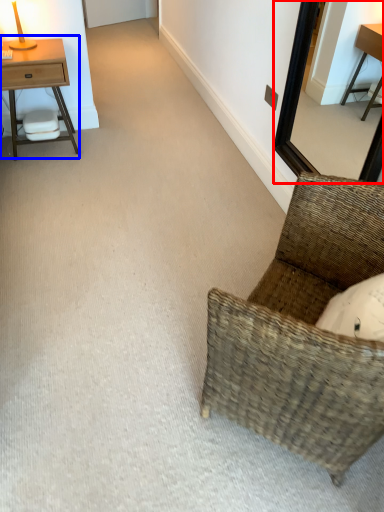
Question: Among these objects, which one is nearest to the camera, mirror (highlighted by a red box) or nightstand (highlighted by a blue box)?

Choices:
 (A) mirror
 (B) nightstand

Answer: (A)